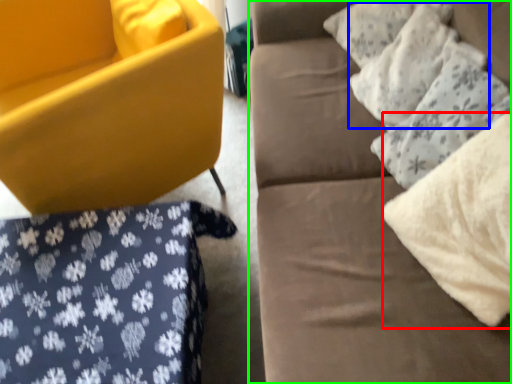
Question: Considering the real-world distances, which object is closest to material (highlighted by a red box)? pillow (highlighted by a blue box) or studio couch (highlighted by a green box).

Choices:
 (A) pillow
 (B) studio couch

Answer: (B)